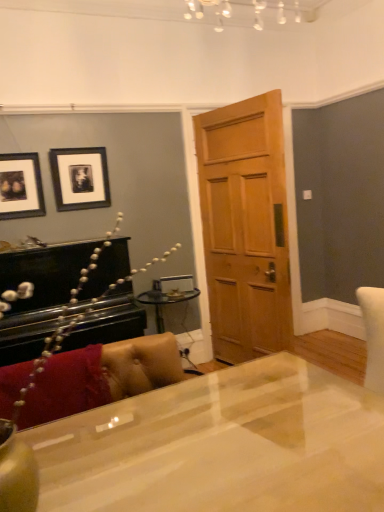
Question: From the image's perspective, would you say black matte picture frame at upper left, which is counted as the 1th picture frame, starting from the right, is positioned over wooden door at center?

Choices:
 (A) no
 (B) yes

Answer: (B)

Question: Does black matte picture frame at upper left, placed as the 2th picture frame when sorted from left to right, have a greater height compared to wooden door at center?

Choices:
 (A) yes
 (B) no

Answer: (B)

Question: Is black matte picture frame at upper left, which is counted as the 1th picture frame, starting from the right, thinner than wooden door at center?

Choices:
 (A) no
 (B) yes

Answer: (B)

Question: Does black matte picture frame at upper left, placed as the 2th picture frame when sorted from left to right, appear on the left side of wooden door at center?

Choices:
 (A) yes
 (B) no

Answer: (A)

Question: Is black matte picture frame at upper left, which is counted as the 1th picture frame, starting from the right, to the right of wooden door at center from the viewer's perspective?

Choices:
 (A) no
 (B) yes

Answer: (A)

Question: From a real-world perspective, is black matte picture frame at upper left, placed as the 2th picture frame when sorted from left to right, physically below wooden door at center?

Choices:
 (A) yes
 (B) no

Answer: (B)

Question: Would you say wooden door at center contains glossy white desk at center?

Choices:
 (A) yes
 (B) no

Answer: (B)

Question: Does wooden door at center have a larger size compared to glossy white desk at center?

Choices:
 (A) no
 (B) yes

Answer: (A)

Question: Can you confirm if wooden door at center is thinner than glossy white desk at center?

Choices:
 (A) yes
 (B) no

Answer: (A)

Question: Is wooden door at center wider than glossy white desk at center?

Choices:
 (A) yes
 (B) no

Answer: (B)

Question: Is wooden door at center touching glossy white desk at center?

Choices:
 (A) yes
 (B) no

Answer: (B)

Question: Is wooden door at center at the left side of glossy white desk at center?

Choices:
 (A) no
 (B) yes

Answer: (A)

Question: From a real-world perspective, is glossy white desk at center below black matte picture frame at upper left, placed as the 2th picture frame when sorted from left to right?

Choices:
 (A) yes
 (B) no

Answer: (A)